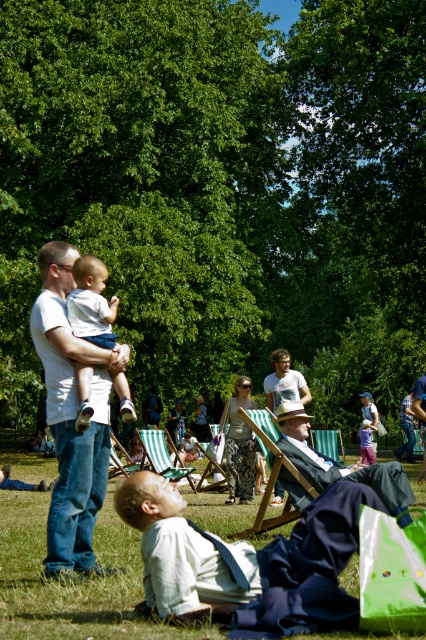
You are a photographer trying to capture a clear shot of the matte white baby at center and the green striped beach chair at center. However, you notice that the baby is blocking the view of the chair. Can you adjust your position to see both objects clearly?

The matte white baby at center is in front of the green striped beach chair at center, so moving your camera position slightly to the side or angle might allow you to capture both objects without obstruction.

You are a photographer positioned behind the matte white baby at center and the green fabric deck chair at center. To capture both subjects in focus, which subject should you adjust your camera to focus on first?

The matte white baby at center is in front of the green fabric deck chair at center, so to ensure both are in focus, you should set the focus on the matte white baby at center first as it is closer to the camera.